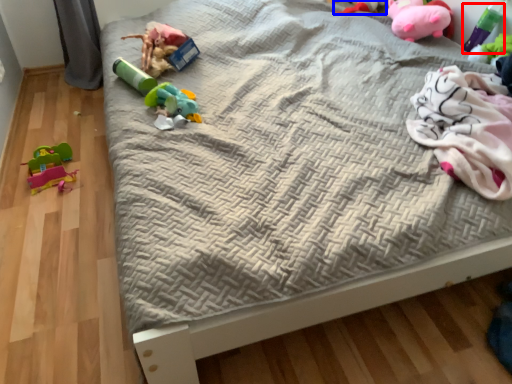
Question: Which point is closer to the camera, toy (highlighted by a red box) or toy (highlighted by a blue box)?

Choices:
 (A) toy
 (B) toy

Answer: (A)